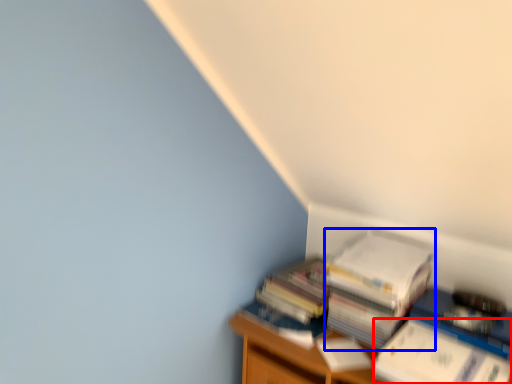
Question: Which object is further to the camera taking this photo, paperback book (highlighted by a red box) or paperback book (highlighted by a blue box)?

Choices:
 (A) paperback book
 (B) paperback book

Answer: (B)